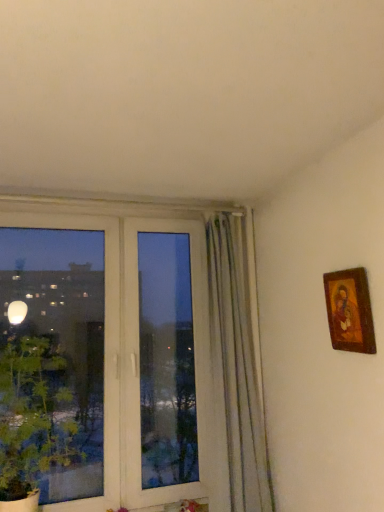
Question: From a real-world perspective, is wooden-framed painting at upper right positioned above or below green leafy plant at left?

Choices:
 (A) above
 (B) below

Answer: (A)

Question: Is wooden-framed painting at upper right wider or thinner than green leafy plant at left?

Choices:
 (A) thin
 (B) wide

Answer: (A)

Question: Considering the relative positions of wooden-framed painting at upper right and green leafy plant at left in the image provided, is wooden-framed painting at upper right to the left or to the right of green leafy plant at left?

Choices:
 (A) right
 (B) left

Answer: (A)

Question: Would you say green leafy plant at left is inside or outside wooden-framed painting at upper right?

Choices:
 (A) outside
 (B) inside

Answer: (A)

Question: From a real-world perspective, is green leafy plant at left positioned above or below wooden-framed painting at upper right?

Choices:
 (A) above
 (B) below

Answer: (B)

Question: Based on their positions, is green leafy plant at left located to the left or right of wooden-framed painting at upper right?

Choices:
 (A) left
 (B) right

Answer: (A)

Question: Is green leafy plant at left taller or shorter than wooden-framed painting at upper right?

Choices:
 (A) tall
 (B) short

Answer: (A)